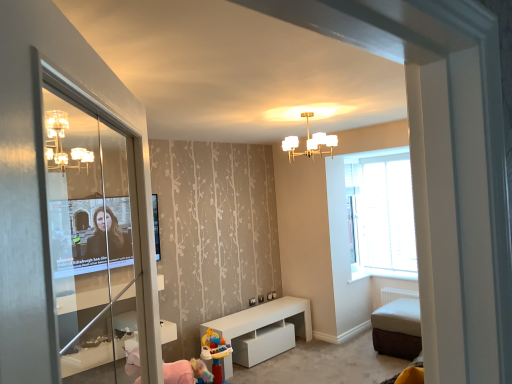
Question: From the image's perspective, does white glass chandelier at upper center appear lower than white matte table at center?

Choices:
 (A) no
 (B) yes

Answer: (A)

Question: From a real-world perspective, is white glass chandelier at upper center located beneath white matte table at center?

Choices:
 (A) yes
 (B) no

Answer: (B)

Question: Considering the relative sizes of white glass chandelier at upper center and white matte table at center in the image provided, is white glass chandelier at upper center thinner than white matte table at center?

Choices:
 (A) yes
 (B) no

Answer: (B)

Question: Is white glass chandelier at upper center wider than white matte table at center?

Choices:
 (A) yes
 (B) no

Answer: (A)

Question: Can you confirm if white glass chandelier at upper center is positioned to the right of white matte table at center?

Choices:
 (A) yes
 (B) no

Answer: (A)

Question: Considering the relative sizes of white glass chandelier at upper center and white matte table at center in the image provided, is white glass chandelier at upper center bigger than white matte table at center?

Choices:
 (A) yes
 (B) no

Answer: (B)

Question: Does clear glass screen door at left have a larger size compared to white matte table at center?

Choices:
 (A) yes
 (B) no

Answer: (B)

Question: Considering the relative sizes of clear glass screen door at left and white matte table at center in the image provided, is clear glass screen door at left thinner than white matte table at center?

Choices:
 (A) yes
 (B) no

Answer: (A)

Question: Can you confirm if clear glass screen door at left is wider than white matte table at center?

Choices:
 (A) yes
 (B) no

Answer: (B)

Question: From the image's perspective, is clear glass screen door at left below white matte table at center?

Choices:
 (A) no
 (B) yes

Answer: (A)

Question: From a real-world perspective, is clear glass screen door at left over white matte table at center?

Choices:
 (A) no
 (B) yes

Answer: (B)

Question: Is clear glass screen door at left to the right of white matte table at center from the viewer's perspective?

Choices:
 (A) no
 (B) yes

Answer: (A)

Question: From a real-world perspective, is clear glass screen door at left located higher than white glass chandelier at upper center?

Choices:
 (A) no
 (B) yes

Answer: (A)